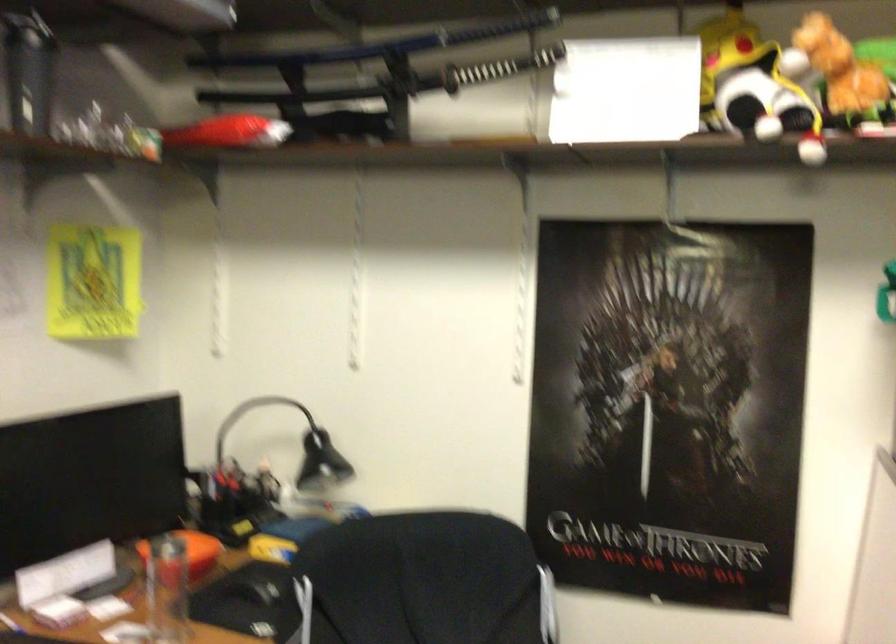
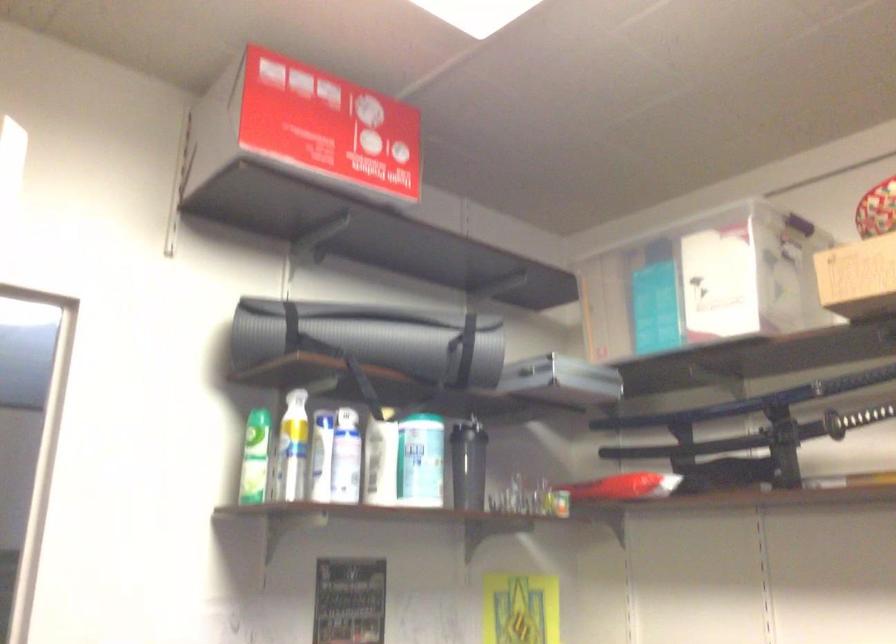
In the second image, find the point that corresponds to [474,76] in the first image.

(855, 419)